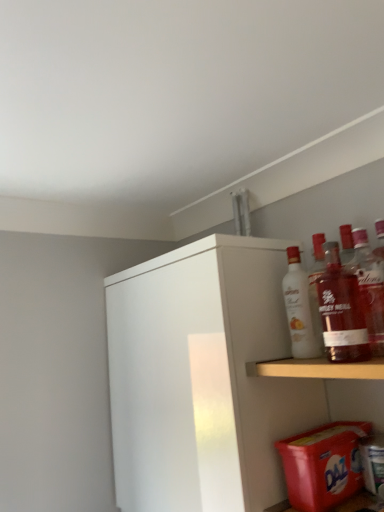
Question: From a real-world perspective, is translucent glass bottle at shelf right physically above red plastic laundry detergent at lower right?

Choices:
 (A) yes
 (B) no

Answer: (A)

Question: Is red plastic laundry detergent at lower right at the back of translucent glass bottle at shelf right?

Choices:
 (A) no
 (B) yes

Answer: (A)

Question: Can you confirm if translucent glass bottle at shelf right is bigger than red plastic laundry detergent at lower right?

Choices:
 (A) yes
 (B) no

Answer: (B)

Question: Can you confirm if translucent glass bottle at shelf right is smaller than red plastic laundry detergent at lower right?

Choices:
 (A) yes
 (B) no

Answer: (A)

Question: Considering the relative sizes of translucent glass bottle at shelf right and red plastic laundry detergent at lower right in the image provided, is translucent glass bottle at shelf right taller than red plastic laundry detergent at lower right?

Choices:
 (A) no
 (B) yes

Answer: (B)

Question: From the image's perspective, does translucent glass bottle at shelf right appear lower than red plastic laundry detergent at lower right?

Choices:
 (A) yes
 (B) no

Answer: (B)

Question: Can you confirm if red plastic laundry detergent at lower right is shorter than white glossy bottle at upper right, placed as the 2th bottle when sorted from right to left?

Choices:
 (A) yes
 (B) no

Answer: (A)

Question: Considering the relative sizes of red plastic laundry detergent at lower right and white glossy bottle at upper right, which appears as the 1th bottle when viewed from the back, in the image provided, is red plastic laundry detergent at lower right thinner than white glossy bottle at upper right, which appears as the 1th bottle when viewed from the back,?

Choices:
 (A) yes
 (B) no

Answer: (B)

Question: Is red plastic laundry detergent at lower right facing towards white glossy bottle at upper right, positioned as the 1th bottle in left-to-right order?

Choices:
 (A) yes
 (B) no

Answer: (B)

Question: Is red plastic laundry detergent at lower right positioned in front of white glossy bottle at upper right, which is the 2th bottle from front to back?

Choices:
 (A) no
 (B) yes

Answer: (B)

Question: From the image's perspective, is red plastic laundry detergent at lower right on top of white glossy bottle at upper right, positioned as the 1th bottle in left-to-right order?

Choices:
 (A) yes
 (B) no

Answer: (B)

Question: Is red plastic laundry detergent at lower right positioned beyond the bounds of white glossy bottle at upper right, placed as the 2th bottle when sorted from right to left?

Choices:
 (A) no
 (B) yes

Answer: (B)

Question: Is white glossy bottle at upper right, which appears as the 1th bottle when viewed from the back, positioned beyond the bounds of white matte cabinet at upper right?

Choices:
 (A) yes
 (B) no

Answer: (A)